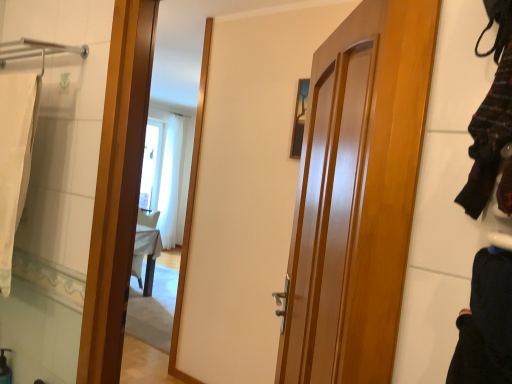
Question: Can you confirm if glossy wood door at center is bigger than white fabric bath towel at left?

Choices:
 (A) no
 (B) yes

Answer: (B)

Question: From a real-world perspective, is glossy wood door at center physically below white fabric bath towel at left?

Choices:
 (A) yes
 (B) no

Answer: (A)

Question: Is glossy wood door at center positioned before white fabric bath towel at left?

Choices:
 (A) no
 (B) yes

Answer: (B)

Question: Can white fabric bath towel at left be found inside glossy wood door at center?

Choices:
 (A) no
 (B) yes

Answer: (A)

Question: Does glossy wood door at center have a greater height compared to white fabric bath towel at left?

Choices:
 (A) no
 (B) yes

Answer: (B)

Question: Considering the relative sizes of glossy wood door at center and white fabric bath towel at left in the image provided, is glossy wood door at center smaller than white fabric bath towel at left?

Choices:
 (A) no
 (B) yes

Answer: (A)

Question: From a real-world perspective, is black cotton pants at lower right, the 1th clothing ordered from the bottom, over glossy wood door at center?

Choices:
 (A) yes
 (B) no

Answer: (A)

Question: Can you confirm if black cotton pants at lower right, arranged as the second clothing when viewed from the top, is bigger than glossy wood door at center?

Choices:
 (A) no
 (B) yes

Answer: (A)

Question: From the image's perspective, would you say black cotton pants at lower right, the 1th clothing ordered from the bottom, is positioned over glossy wood door at center?

Choices:
 (A) no
 (B) yes

Answer: (A)

Question: Considering the relative sizes of black cotton pants at lower right, the 1th clothing ordered from the bottom, and glossy wood door at center in the image provided, is black cotton pants at lower right, the 1th clothing ordered from the bottom, shorter than glossy wood door at center?

Choices:
 (A) no
 (B) yes

Answer: (B)

Question: Would you consider black cotton pants at lower right, arranged as the second clothing when viewed from the top, to be distant from glossy wood door at center?

Choices:
 (A) yes
 (B) no

Answer: (B)

Question: Does black cotton pants at lower right, arranged as the second clothing when viewed from the top, have a greater height compared to glossy wood door at center?

Choices:
 (A) no
 (B) yes

Answer: (A)

Question: Is glossy wood door at center located outside striped wool sweater at right, the first clothing positioned from the top?

Choices:
 (A) no
 (B) yes

Answer: (B)